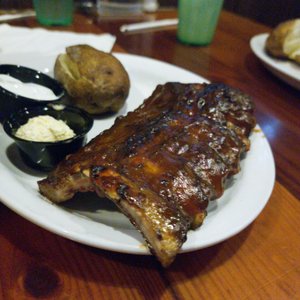
Find the location of a particular element. wood table is located at coordinates (278, 112).